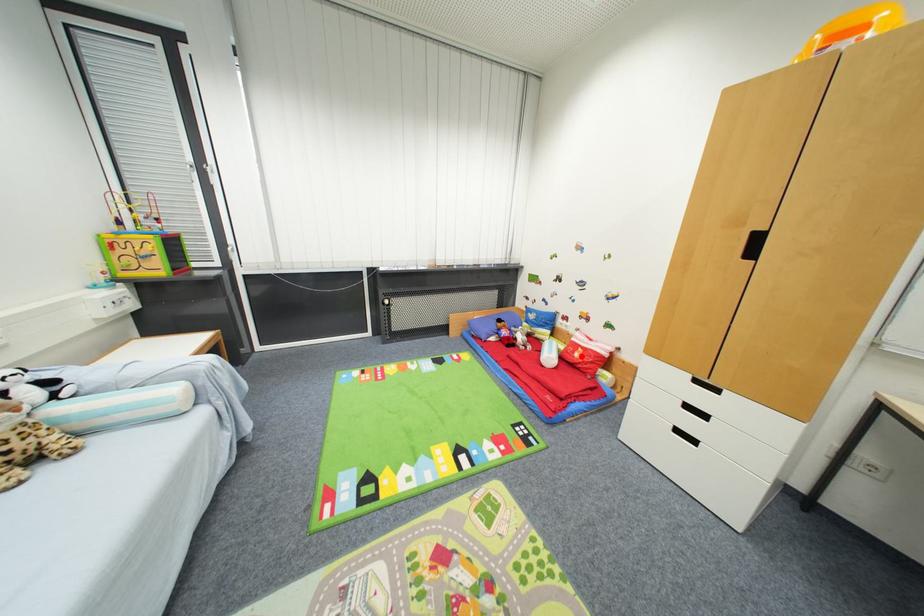
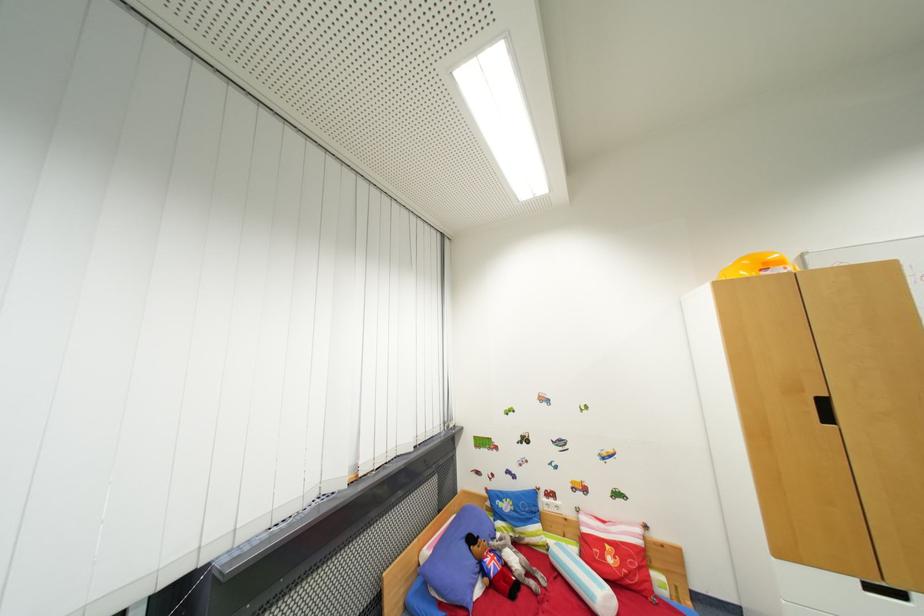
The point at the highlighted location is marked in the first image. Where is the corresponding point in the second image?

(614, 562)